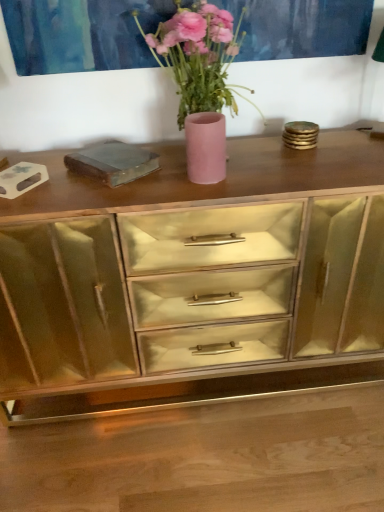
I want to click on unoccupied space behind matte pink vase at center, so click(x=226, y=153).